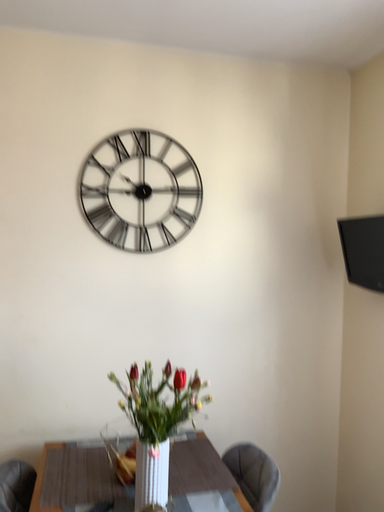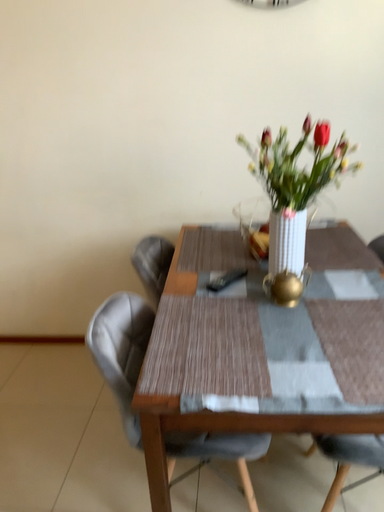
Question: How did the camera likely rotate when shooting the video?

Choices:
 (A) rotated downward
 (B) rotated upward

Answer: (A)